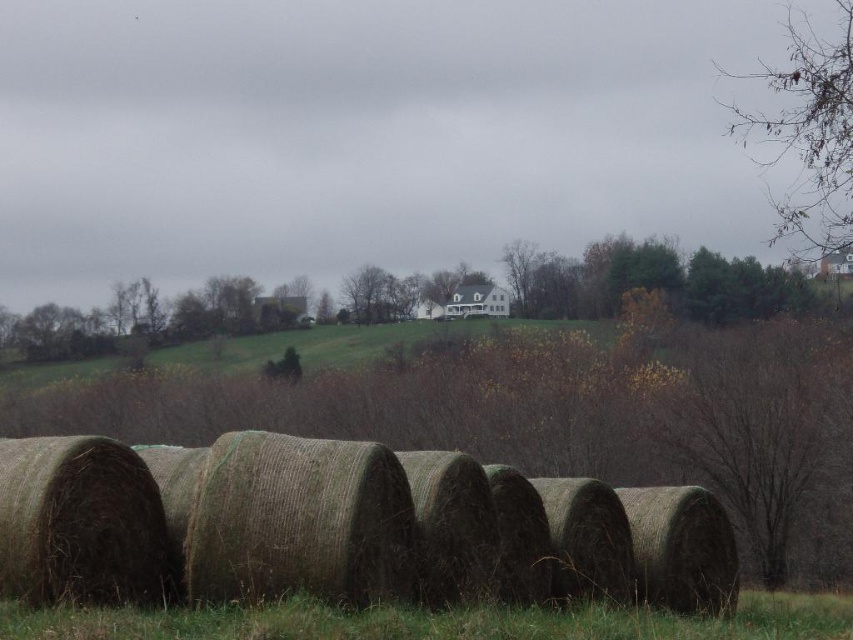
You are a farmer who needs to transport both the green straw bales at center and the green grass at lower center using a truck with a 2.5 meter width limit. Based on their widths, which item can fit through the truck without needing to be moved or adjusted?

The green straw bales at center has a lesser width compared to green grass at lower center. Since the truck has a 2.5 meter width limit, the green straw bales at center can fit through the truck without needing to be moved or adjusted, but the green grass at lower center may not fit due to its wider width.

You are standing at the bottom of the hill and see the green straw bales at center and the green grass at lower center. Which object is higher in elevation?

The green straw bales at center are higher in elevation than the green grass at lower center because the description states that the green straw bales at center is above green grass at lower center.